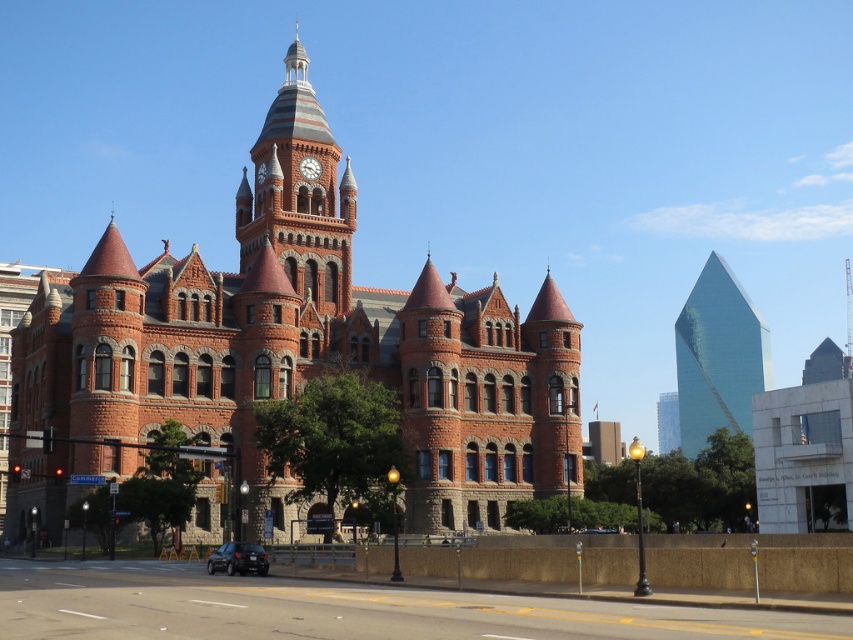
Question: Can you confirm if red brick church at center is positioned to the right of matte red clock at center?

Choices:
 (A) no
 (B) yes

Answer: (A)

Question: Based on their relative distances, which object is farther from the red brick clock tower at center?

Choices:
 (A) red brick church at center
 (B) matte red clock at center
 (C) glassy reflective skyscraper at right

Answer: (C)

Question: Does red brick church at center appear on the left side of glassy reflective skyscraper at right?

Choices:
 (A) no
 (B) yes

Answer: (B)

Question: Considering the relative positions of red brick church at center and glassy reflective skyscraper at right in the image provided, where is red brick church at center located with respect to glassy reflective skyscraper at right?

Choices:
 (A) right
 (B) left

Answer: (B)

Question: Estimate the real-world distances between objects in this image. Which object is farther from the glassy reflective skyscraper at right?

Choices:
 (A) red brick church at center
 (B) matte red clock at center

Answer: (B)

Question: Which of the following is the farthest from the observer?

Choices:
 (A) (531, 339)
 (B) (695, 420)
 (C) (309, 236)

Answer: (B)